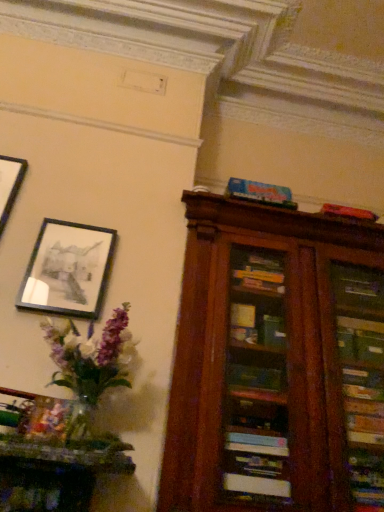
Question: Should I look upward or downward to see blue matte board game at upper center?

Choices:
 (A) up
 (B) down

Answer: (A)

Question: From a real-world perspective, is blue matte board game at upper center located higher than translucent glass vase at left?

Choices:
 (A) no
 (B) yes

Answer: (B)

Question: From the image's perspective, is blue matte board game at upper center located above translucent glass vase at left?

Choices:
 (A) yes
 (B) no

Answer: (A)

Question: Is blue matte board game at upper center touching translucent glass vase at left?

Choices:
 (A) no
 (B) yes

Answer: (A)

Question: Does blue matte board game at upper center lie in front of translucent glass vase at left?

Choices:
 (A) no
 (B) yes

Answer: (A)

Question: From the image's perspective, is blue matte board game at upper center located beneath translucent glass vase at left?

Choices:
 (A) no
 (B) yes

Answer: (A)

Question: Is translucent glass vase at left at the back of blue matte board game at upper center?

Choices:
 (A) yes
 (B) no

Answer: (B)

Question: Considering the relative sizes of matte black picture frame at upper left and blue matte board game at upper center in the image provided, is matte black picture frame at upper left thinner than blue matte board game at upper center?

Choices:
 (A) no
 (B) yes

Answer: (B)

Question: Would you say matte black picture frame at upper left is outside blue matte board game at upper center?

Choices:
 (A) no
 (B) yes

Answer: (B)

Question: Is the position of matte black picture frame at upper left less distant than that of blue matte board game at upper center?

Choices:
 (A) no
 (B) yes

Answer: (B)

Question: Considering the relative sizes of matte black picture frame at upper left and blue matte board game at upper center in the image provided, is matte black picture frame at upper left shorter than blue matte board game at upper center?

Choices:
 (A) yes
 (B) no

Answer: (B)

Question: Is matte black picture frame at upper left wider than blue matte board game at upper center?

Choices:
 (A) no
 (B) yes

Answer: (A)

Question: Is matte black picture frame at upper left facing away from blue matte board game at upper center?

Choices:
 (A) yes
 (B) no

Answer: (B)

Question: Is blue matte board game at upper center oriented away from matte black picture frame at upper left?

Choices:
 (A) yes
 (B) no

Answer: (B)